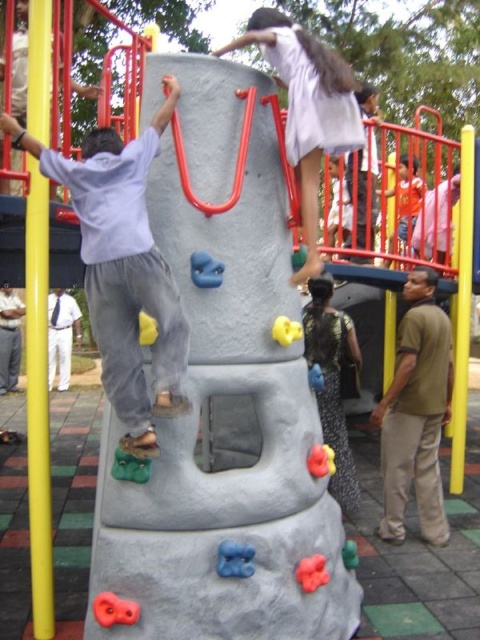
You are a photographer trying to capture a candid shot of both the brown cotton shirt at right and the white cotton pants at lower left. Since you want to ensure both are visible in the frame, which object should you focus on first to account for their sizes?

You should focus on the brown cotton shirt at right first because it is smaller in size compared to the white cotton pants at lower left, so ensuring it is properly framed will help include both in the shot.

Based on the coordinates provided, where exactly is the matte gray climbing wall at center located in the image?

The matte gray climbing wall at center is located at point coordinates of 0.419 on the x axis and 0.256 on the y axis.